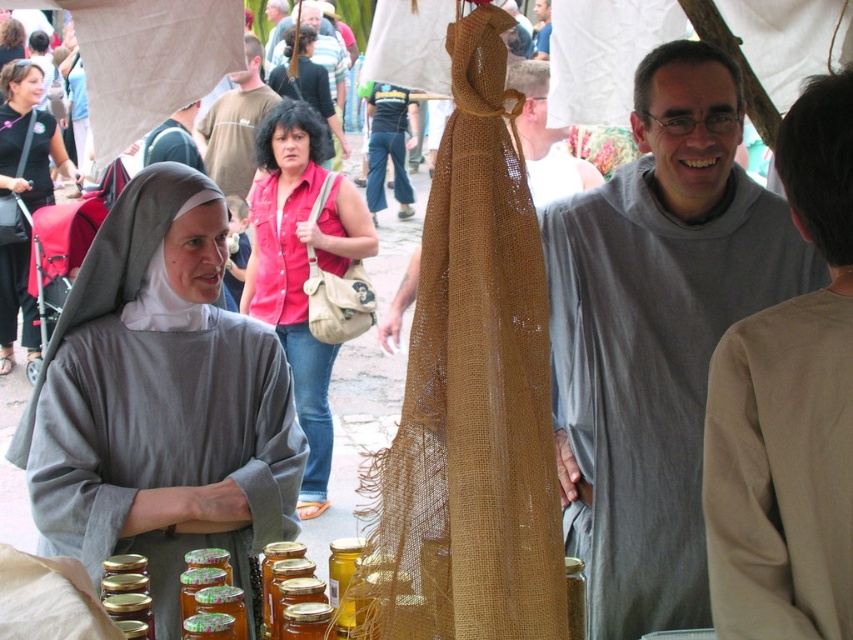
This screenshot has width=853, height=640. I want to click on matte gray robe at center, so click(160, 401).

Between point (169, 621) and point (538, 36), which one is positioned behind?

The point (538, 36) is behind.

You are a GUI agent. You are given a task and a screenshot of the screen. Output one action in this format:
    pyautogui.click(x=<x>, y=<y>)
    Task: Click on the matte gray robe at center
    The height and width of the screenshot is (640, 853).
    Given the screenshot: What is the action you would take?
    pyautogui.click(x=160, y=401)

Can you confirm if gray woolen robe at center is wider than matte black dress at left?

Yes.

Between gray woolen robe at center and matte black dress at left, which one has less height?

matte black dress at left is shorter.

Identify the location of gray woolen robe at center. (656, 333).

Does burlap shawl at center come behind matte pink shirt at center?

That is False.

Between point (479, 307) and point (314, 378), which one is positioned in front?

Point (479, 307)

Identify the location of burlap shawl at center. This screenshot has height=640, width=853. (471, 392).